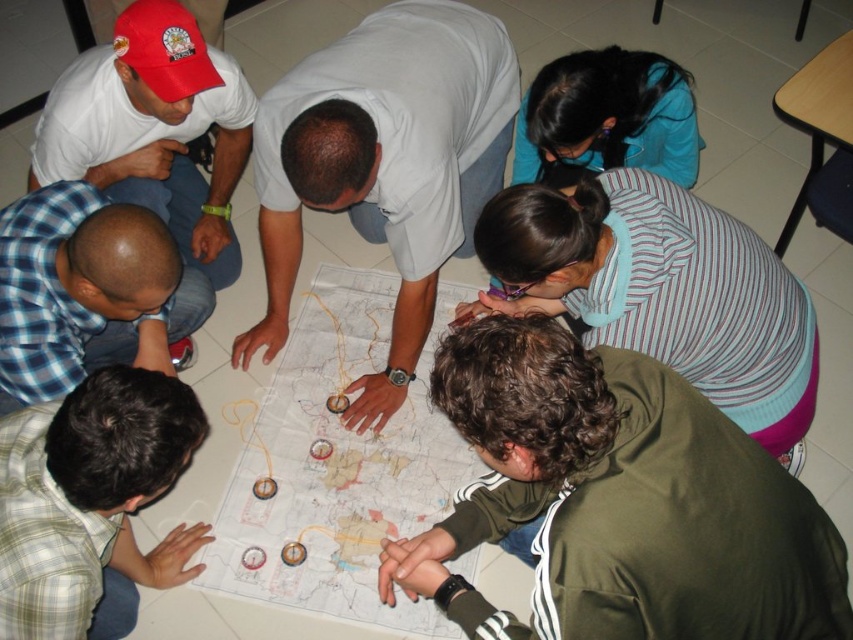
Question: Which of these objects is positioned closest to the blue fabric shirt at upper center?

Choices:
 (A) white paper map at center
 (B) green plaid shirt at lower left
 (C) striped fabric shirt at lower center

Answer: (C)

Question: Can you confirm if gray smooth shirt at center is thinner than blue fabric shirt at upper center?

Choices:
 (A) no
 (B) yes

Answer: (A)

Question: Is green matte jacket at lower right closer to the viewer compared to white paper map at center?

Choices:
 (A) yes
 (B) no

Answer: (A)

Question: Among these points, which one is farthest from the camera?

Choices:
 (A) (718, 557)
 (B) (107, 522)
 (C) (247, 353)
 (D) (422, 477)

Answer: (C)

Question: Which object is positioned farthest from the white paper map at center?

Choices:
 (A) striped fabric shirt at lower center
 (B) green plaid shirt at lower left
 (C) gray smooth shirt at center
 (D) green matte jacket at lower right

Answer: (D)

Question: Does gray smooth shirt at center appear over white paper map at center?

Choices:
 (A) no
 (B) yes

Answer: (B)